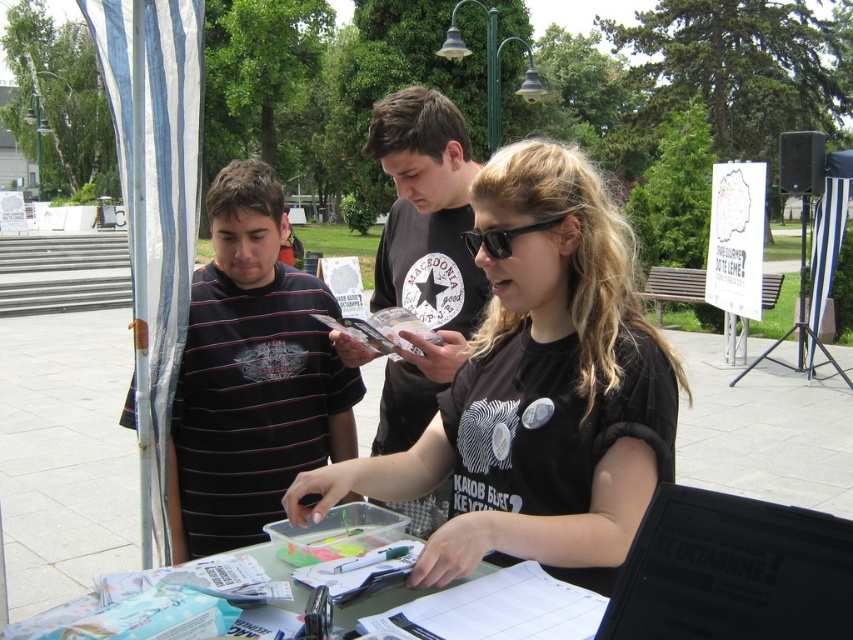
Question: Which point is farther from the camera taking this photo?

Choices:
 (A) (682, 563)
 (B) (438, 152)

Answer: (B)

Question: In this image, where is black plastic laptop at lower right located relative to black plastic sunglasses at center?

Choices:
 (A) left
 (B) right

Answer: (B)

Question: Can you confirm if black cotton shirt at center is smaller than black plastic sunglasses at center?

Choices:
 (A) no
 (B) yes

Answer: (A)

Question: Among these objects, which one is farthest from the camera?

Choices:
 (A) black striped shirt at left
 (B) black plastic sunglasses at center
 (C) black matte t-shirt at center

Answer: (A)

Question: Is black matte t-shirt at center above black plastic laptop at lower right?

Choices:
 (A) no
 (B) yes

Answer: (B)

Question: Which of the following is the farthest from the observer?

Choices:
 (A) black plastic laptop at lower right
 (B) black matte t-shirt at center

Answer: (B)